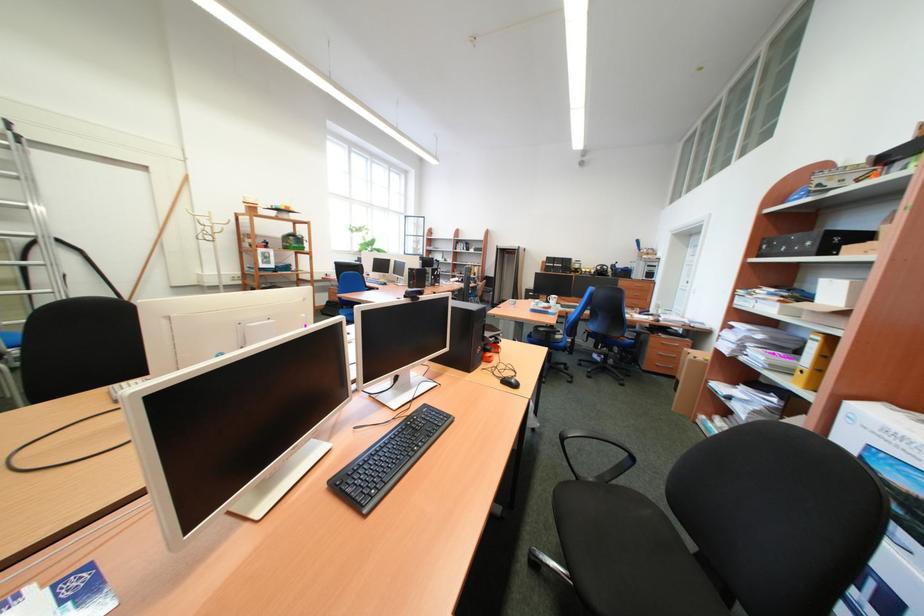
This screenshot has width=924, height=616. What do you see at coordinates (208, 225) in the screenshot?
I see `a white coat rack hook` at bounding box center [208, 225].